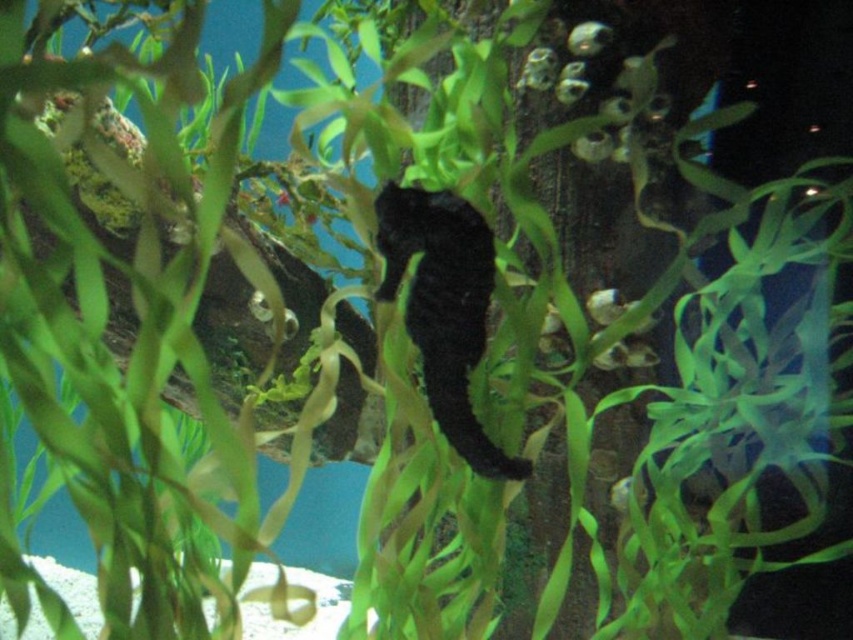
You are an underwater photographer aiming to capture both the shiny silver fish at upper center and the translucent green fish at center in a single shot. Which fish should you focus on first to ensure both are in focus?

You should focus on the shiny silver fish at upper center first because it is closer to you than the translucent green fish at center, so adjusting focus from near to far will help both be in focus.

You are a marine biologist observing an aquarium. You notice a shiny silver fish at upper center and a translucent green fish at center. You need to place a divider between them to separate them. What is the minimum length of the divider required to fit between them?

The divider must be at least 20.96 inches long to fit between the shiny silver fish at upper center and the translucent green fish at center since the distance between them is exactly 20.96 inches.